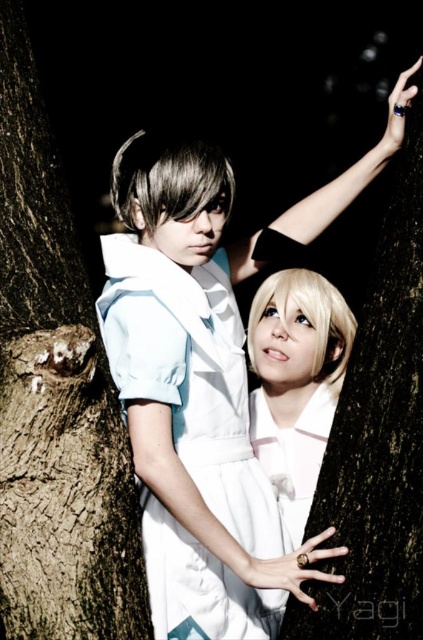
Locate an element on the screen. brown rough tree trunk at left is located at coordinates (54, 397).

The width and height of the screenshot is (423, 640). What are the coordinates of `brown rough tree trunk at left` in the screenshot? It's located at (54, 397).

The width and height of the screenshot is (423, 640). In order to click on brown rough tree trunk at left in this screenshot , I will do `click(54, 397)`.